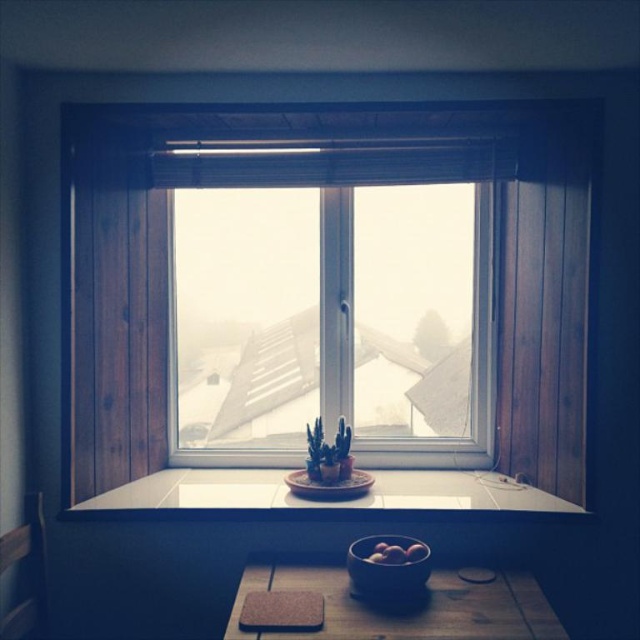
You are standing in the room looking at the window sill. There are two points marked on the sill, one at point [572,404] and another at point [326,508]. Which point is closer to you?

Point [572,404] is further to the camera than point [326,508], so the point closer to you is point [326,508].